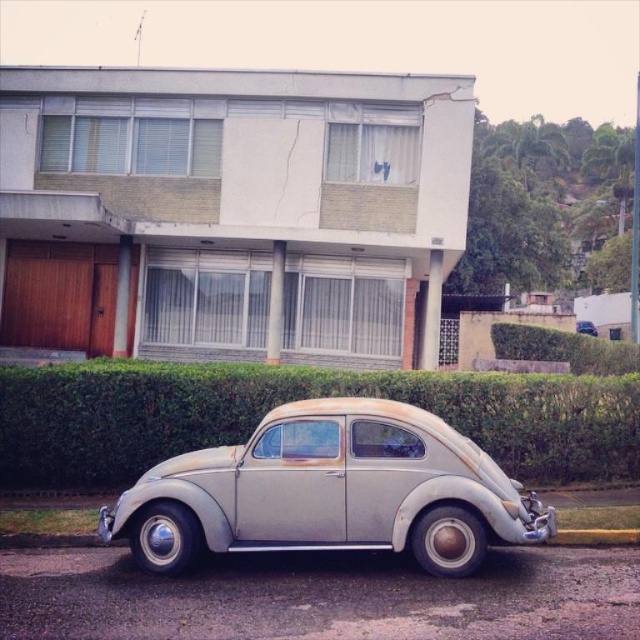
Question: Which point appears closest to the camera in this image?

Choices:
 (A) (552, 515)
 (B) (529, 451)

Answer: (A)

Question: From the image, what is the correct spatial relationship of rusty metallic car at center in relation to green leafy hedge at lower center?

Choices:
 (A) left
 (B) right

Answer: (B)

Question: Does rusty metallic car at center have a greater width compared to green leafy hedge at lower center?

Choices:
 (A) no
 (B) yes

Answer: (A)

Question: Among these objects, which one is nearest to the camera?

Choices:
 (A) rusty metallic car at center
 (B) green leafy hedge at lower center

Answer: (A)

Question: Can you confirm if rusty metallic car at center is thinner than green leafy hedge at lower center?

Choices:
 (A) no
 (B) yes

Answer: (B)

Question: Which of the following is the farthest from the observer?

Choices:
 (A) rusty metallic car at center
 (B) green leafy hedge at lower center

Answer: (B)